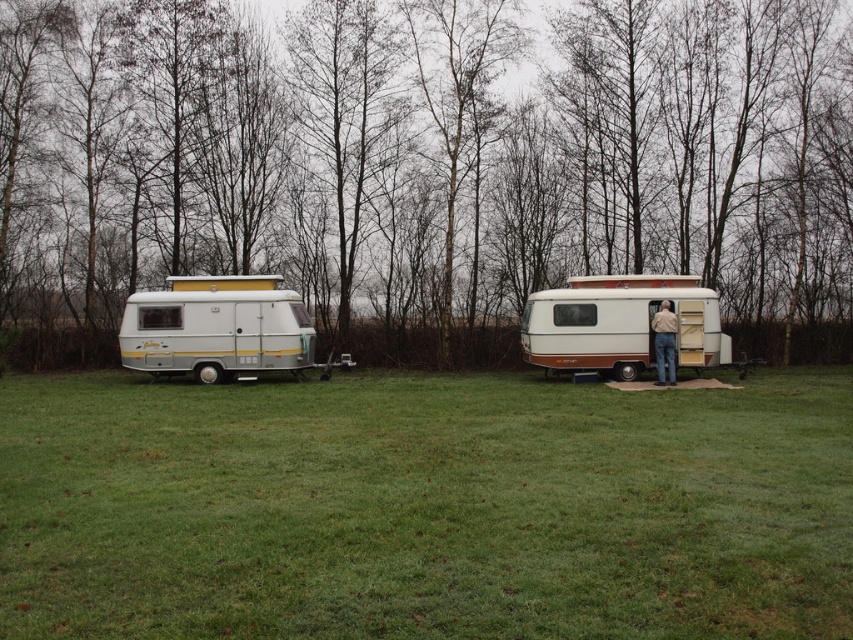
Question: Estimate the real-world distances between objects in this image. Which object is closer to the brown textured caravan at center?

Choices:
 (A) green grass at center
 (B) brown leather jacket at center

Answer: (B)

Question: Observing the image, what is the correct spatial positioning of green grass at center in reference to brown leather jacket at center?

Choices:
 (A) below
 (B) above

Answer: (A)

Question: Which object is positioned farthest from the green grass at center?

Choices:
 (A) silver metallic camper at left
 (B) brown wood tree at upper center
 (C) brown leather jacket at center

Answer: (B)

Question: Observing the image, what is the correct spatial positioning of brown wood tree at upper center in reference to brown leather jacket at center?

Choices:
 (A) above
 (B) below

Answer: (A)

Question: Which of the following is the farthest from the observer?

Choices:
 (A) (840, 545)
 (B) (247, 365)
 (C) (688, 349)

Answer: (B)

Question: Does brown wood tree at upper center have a greater width compared to green grass at center?

Choices:
 (A) no
 (B) yes

Answer: (B)